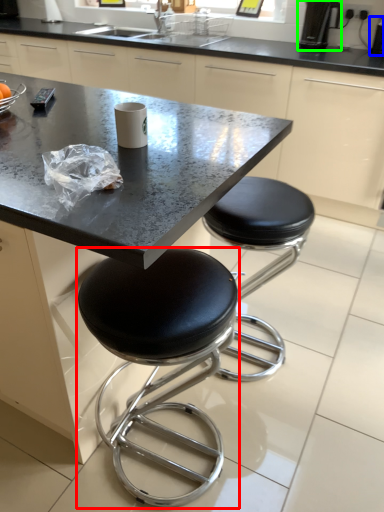
Question: Based on their relative distances, which object is farther from stool (highlighted by a red box)? Choose from appliance (highlighted by a blue box) and coffee machine (highlighted by a green box).

Choices:
 (A) appliance
 (B) coffee machine

Answer: (A)